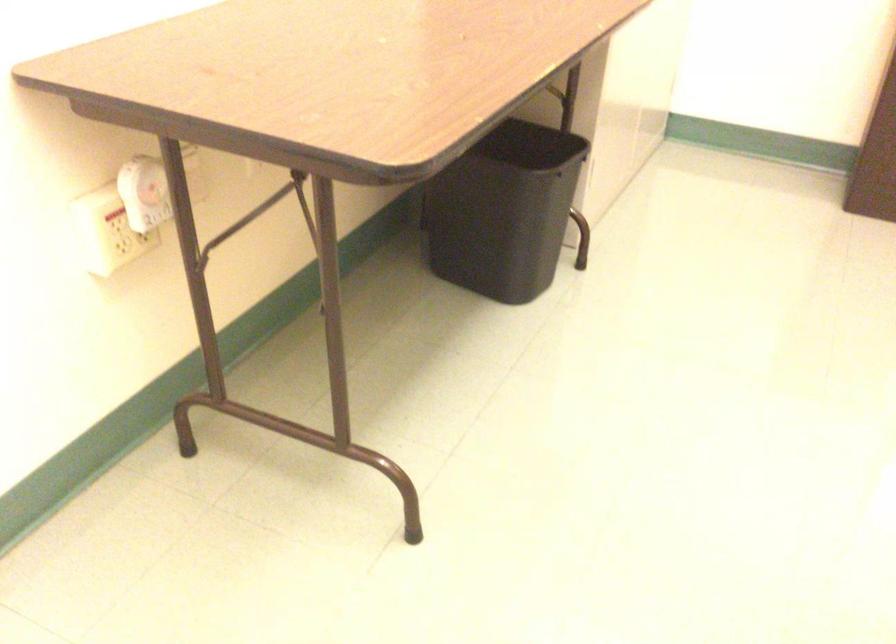
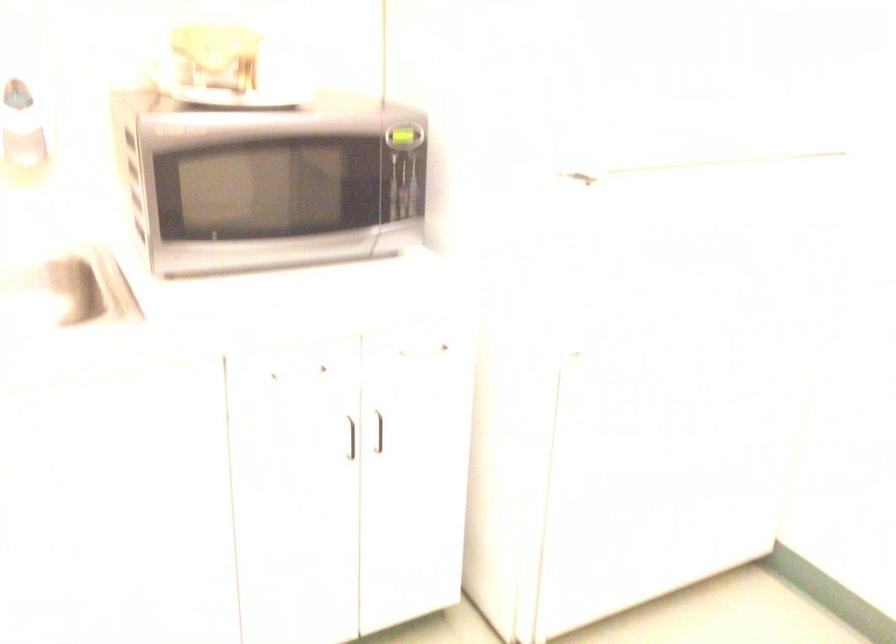
How did the camera likely rotate?

The camera rotated toward left-down.